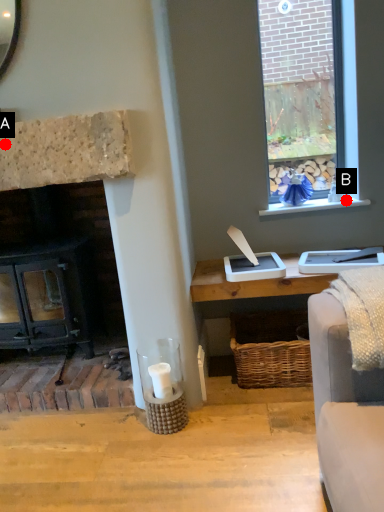
Question: Two points are circled on the image, labeled by A and B beside each circle. Among these points, which one is farthest from the camera?

Choices:
 (A) A is further
 (B) B is further

Answer: (B)